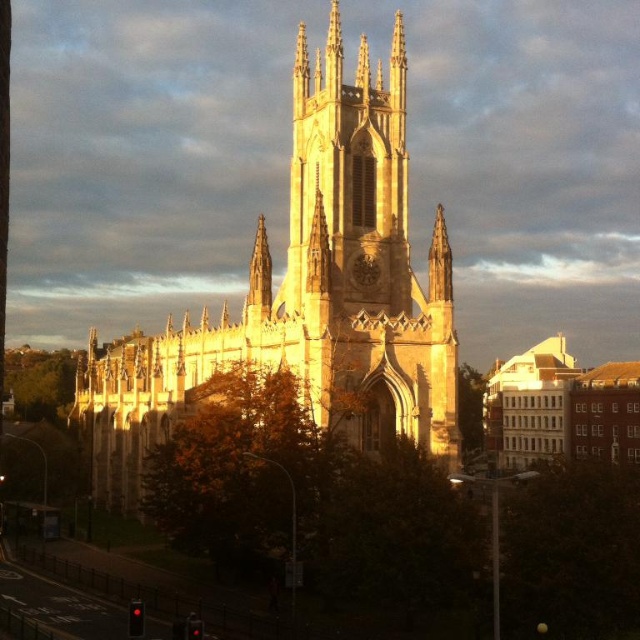
You are standing in front of the Gothic church and want to take a photo. There are two points marked in the scene. The first point is at coordinates point (381, 358) and the second is at point (577, 394). Which point is closer to your camera position?

The point at (381, 358) is closer to the camera than the point at (577, 394).

You are standing at a certain distance from the golden stone church at center. If you want to take a photo of it without any obstructions, would you need to move closer or farther away? Explain your reasoning based on the distance provided.

The golden stone church at center is 77.58 meters away from the camera. Since the trees in the foreground are partially obscuring the view, moving farther away might increase the likelihood of obstructions. However, moving closer could reduce the obstruction by allowing a clearer line of sight. Wait, but the distance is already quite far. Hmm, maybe the trees are closer to the camera than the church. Therefore, to avoid the trees blocking the view, you should move farther away so that the trees are no longe

You are standing in front of a church and see both the golden stone church at center and the light brown stone church at center. Which one is positioned to the left?

The golden stone church at center is to the left of the light brown stone church at center.